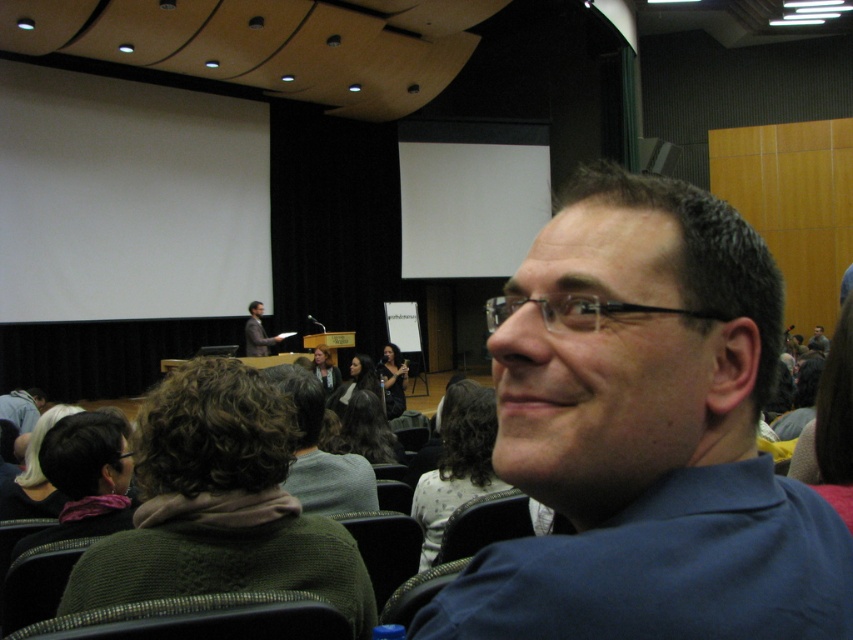
You are an attendee at the lecture hall and you see the white fabric headband at lower left and the light brown hair at center. Which object is shorter?

The white fabric headband at lower left is shorter than the light brown hair at center.

You are standing in the lecture hall and want to place a small decorative item exactly at the position where the white fabric headband at lower left is currently located. What are the coordinates of that position?

The coordinates of the position where the white fabric headband at lower left is located are at point [33,476].

You are attending a lecture and notice two distinct features in the front row of the audience. One is a white fabric headband at lower left and the other is curly brown hair at center. From your perspective, which one is positioned to the left?

The white fabric headband at lower left is positioned to the left of curly brown hair at center.